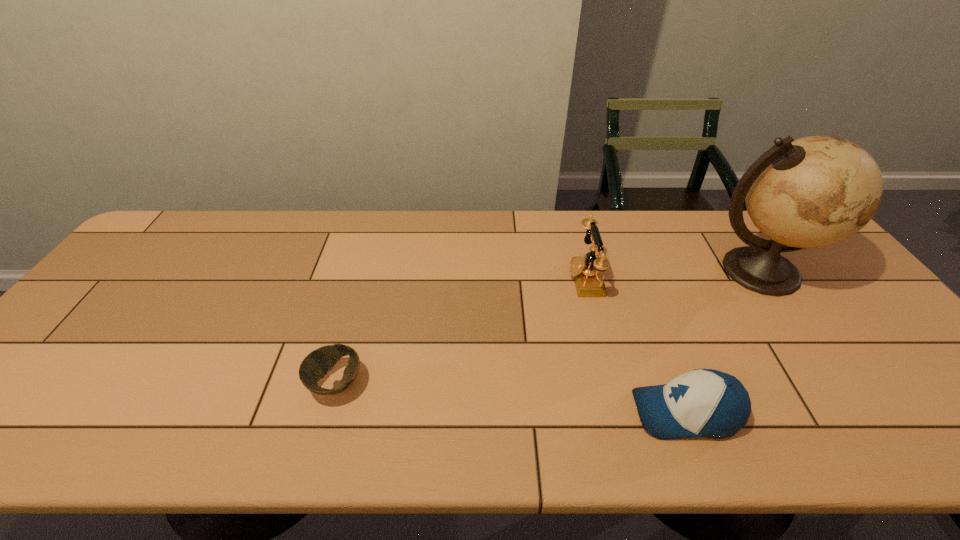
The image size is (960, 540). In order to click on the rightmost object in this screenshot , I will do `click(815, 191)`.

Locate an element on the screen. globe is located at coordinates (815, 191).

Identify the location of telephone. (586, 271).

The image size is (960, 540). What are the coordinates of `the second shortest object` in the screenshot? It's located at (709, 403).

Locate an element on the screen. The height and width of the screenshot is (540, 960). the leftmost object is located at coordinates (316, 364).

Find the location of `the shortest object`. the shortest object is located at coordinates (316, 364).

Where is `free region located on the front-facing side of the globe`? This screenshot has height=540, width=960. free region located on the front-facing side of the globe is located at coordinates (839, 390).

Image resolution: width=960 pixels, height=540 pixels. What are the coordinates of `vacant space situated on the dial of the second tallest object` in the screenshot? It's located at (513, 278).

Where is `free space located on the dial of the second tallest object`? free space located on the dial of the second tallest object is located at coordinates (513, 278).

Where is `vacant space situated on the dial of the second tallest object`? vacant space situated on the dial of the second tallest object is located at coordinates (533, 278).